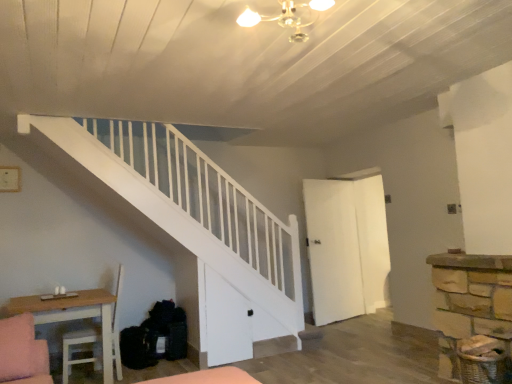
Question: Is light wood table at lower left oriented away from white matte door at center-right?

Choices:
 (A) no
 (B) yes

Answer: (A)

Question: Does light wood table at lower left have a larger size compared to white matte door at center-right?

Choices:
 (A) no
 (B) yes

Answer: (B)

Question: Is white matte door at center-right surrounded by light wood table at lower left?

Choices:
 (A) yes
 (B) no

Answer: (B)

Question: Considering the relative positions of light wood table at lower left and white matte door at center-right in the image provided, is light wood table at lower left to the right of white matte door at center-right from the viewer's perspective?

Choices:
 (A) yes
 (B) no

Answer: (B)

Question: Does light wood table at lower left have a smaller size compared to white matte door at center-right?

Choices:
 (A) yes
 (B) no

Answer: (B)

Question: Can you confirm if light wood table at lower left is positioned to the left of white matte door at center-right?

Choices:
 (A) no
 (B) yes

Answer: (B)

Question: From a real-world perspective, is white matte door at center-right under light wood table at lower left?

Choices:
 (A) no
 (B) yes

Answer: (A)

Question: Is white matte door at center-right not within light wood table at lower left?

Choices:
 (A) yes
 (B) no

Answer: (A)

Question: Is white matte door at center-right taller than light wood table at lower left?

Choices:
 (A) no
 (B) yes

Answer: (B)

Question: Does white matte door at center-right appear on the left side of light wood table at lower left?

Choices:
 (A) yes
 (B) no

Answer: (B)

Question: Does white matte door at center-right turn towards light wood table at lower left?

Choices:
 (A) no
 (B) yes

Answer: (A)

Question: Is white matte door at center-right wider than light wood table at lower left?

Choices:
 (A) yes
 (B) no

Answer: (B)

Question: In the image, is light wood table at lower left positioned in front of or behind white matte door at center-right?

Choices:
 (A) front
 (B) behind

Answer: (A)